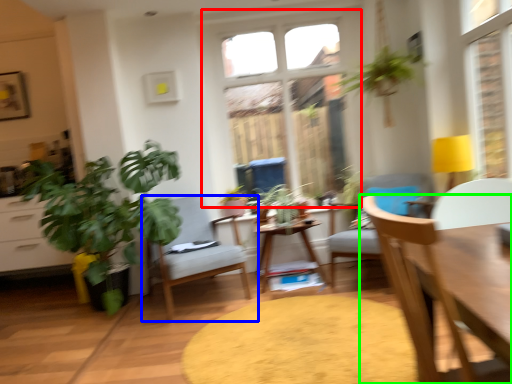
Question: Which is nearer to the window (highlighted by a red box)? chair (highlighted by a blue box) or chair (highlighted by a green box).

Choices:
 (A) chair
 (B) chair

Answer: (A)